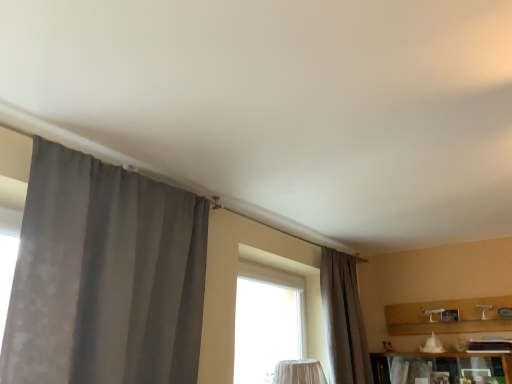
The height and width of the screenshot is (384, 512). What do you see at coordinates (344, 319) in the screenshot?
I see `gray textured curtain at center, acting as the 1th curtain starting from the right` at bounding box center [344, 319].

Measure the distance between gray textured curtain at center, acting as the 1th curtain starting from the right, and camera.

They are 10.87 feet apart.

You are a GUI agent. You are given a task and a screenshot of the screen. Output one action in this format:
    pyautogui.click(x=<x>, y=<y>)
    Task: Click on the gray textured curtain at center, the 2th curtain from the left
    This screenshot has width=512, height=384.
    Given the screenshot: What is the action you would take?
    pyautogui.click(x=344, y=319)

The width and height of the screenshot is (512, 384). What do you see at coordinates (105, 276) in the screenshot? I see `gray fabric curtain at left, which is counted as the first curtain, starting from the front` at bounding box center [105, 276].

What is the approximate width of gray fabric curtain at left, which appears as the 2th curtain when viewed from the right?

The width of gray fabric curtain at left, which appears as the 2th curtain when viewed from the right, is 11.22 inches.

Measure the distance between gray fabric curtain at left, which ranks as the second curtain in back-to-front order, and camera.

gray fabric curtain at left, which ranks as the second curtain in back-to-front order, is 1.61 meters away from camera.

The height and width of the screenshot is (384, 512). What are the coordinates of `gray fabric curtain at left, which is counted as the first curtain, starting from the front` in the screenshot? It's located at (105, 276).

The image size is (512, 384). Identify the location of gray textured curtain at center, the 2th curtain from the left. (344, 319).

Would you say gray textured curtain at center, acting as the 1th curtain starting from the right, is to the left or to the right of gray fabric curtain at left, which is the 1th curtain in left-to-right order, in the picture?

gray textured curtain at center, acting as the 1th curtain starting from the right, is to the right of gray fabric curtain at left, which is the 1th curtain in left-to-right order.

Which object is closer to the camera taking this photo, gray textured curtain at center, the 2th curtain from the left, or gray fabric curtain at left, which is the 1th curtain in left-to-right order?

gray fabric curtain at left, which is the 1th curtain in left-to-right order.

Is point (360, 323) positioned before point (204, 237)?

No, it is not.

From the image's perspective, is gray textured curtain at center, arranged as the 1th curtain when viewed from the back, positioned above or below gray fabric curtain at left, which is the 1th curtain in left-to-right order?

Based on their image positions, gray textured curtain at center, arranged as the 1th curtain when viewed from the back, is located beneath gray fabric curtain at left, which is the 1th curtain in left-to-right order.

From a real-world perspective, is gray textured curtain at center, arranged as the 1th curtain when viewed from the back, physically located above or below gray fabric curtain at left, which is the 1th curtain in left-to-right order?

From a real-world perspective, gray textured curtain at center, arranged as the 1th curtain when viewed from the back, is physically below gray fabric curtain at left, which is the 1th curtain in left-to-right order.

Considering the sizes of objects gray textured curtain at center, the 2th curtain from the left, and gray fabric curtain at left, which appears as the 2th curtain when viewed from the right, in the image provided, who is thinner, gray textured curtain at center, the 2th curtain from the left, or gray fabric curtain at left, which appears as the 2th curtain when viewed from the right,?

With smaller width is gray textured curtain at center, the 2th curtain from the left.

Who is taller, gray textured curtain at center, arranged as the 1th curtain when viewed from the back, or gray fabric curtain at left, which is counted as the first curtain, starting from the front?

gray textured curtain at center, arranged as the 1th curtain when viewed from the back, is taller.

Looking at the image, does gray textured curtain at center, positioned as the 2th curtain in front-to-back order, seem bigger or smaller compared to gray fabric curtain at left, which appears as the 2th curtain when viewed from the right?

Considering their sizes, gray textured curtain at center, positioned as the 2th curtain in front-to-back order, takes up less space than gray fabric curtain at left, which appears as the 2th curtain when viewed from the right.

Can we say gray textured curtain at center, arranged as the 1th curtain when viewed from the back, lies outside gray fabric curtain at left, which ranks as the second curtain in back-to-front order?

That's correct, gray textured curtain at center, arranged as the 1th curtain when viewed from the back, is outside of gray fabric curtain at left, which ranks as the second curtain in back-to-front order.

Is gray textured curtain at center, acting as the 1th curtain starting from the right, touching gray fabric curtain at left, which ranks as the second curtain in back-to-front order?

No, gray textured curtain at center, acting as the 1th curtain starting from the right, is not in contact with gray fabric curtain at left, which ranks as the second curtain in back-to-front order.

Is gray textured curtain at center, arranged as the 1th curtain when viewed from the back, positioned with its back to gray fabric curtain at left, which is the 1th curtain in left-to-right order?

No, gray fabric curtain at left, which is the 1th curtain in left-to-right order, is not at the back of gray textured curtain at center, arranged as the 1th curtain when viewed from the back.

What's the angular difference between gray textured curtain at center, the 2th curtain from the left, and gray fabric curtain at left, which ranks as the second curtain in back-to-front order,'s facing directions?

0.000194 degrees.

Measure the distance from gray textured curtain at center, arranged as the 1th curtain when viewed from the back, to gray fabric curtain at left, which appears as the 2th curtain when viewed from the right.

gray textured curtain at center, arranged as the 1th curtain when viewed from the back, is 6.33 feet from gray fabric curtain at left, which appears as the 2th curtain when viewed from the right.

This screenshot has height=384, width=512. In order to click on curtain above the gray textured curtain at center, arranged as the 1th curtain when viewed from the back (from a real-world perspective) in this screenshot , I will do `click(105, 276)`.

Is gray fabric curtain at left, which is counted as the first curtain, starting from the front, at the right side of gray textured curtain at center, arranged as the 1th curtain when viewed from the back?

No.

Does gray fabric curtain at left, which appears as the 2th curtain when viewed from the right, come in front of gray textured curtain at center, acting as the 1th curtain starting from the right?

Yes, gray fabric curtain at left, which appears as the 2th curtain when viewed from the right, is closer to the viewer.

Does point (81, 191) come in front of point (368, 369)?

Yes.

From the image's perspective, which one is positioned higher, gray fabric curtain at left, which ranks as the second curtain in back-to-front order, or gray textured curtain at center, acting as the 1th curtain starting from the right?

gray fabric curtain at left, which ranks as the second curtain in back-to-front order, from the image's perspective.

From a real-world perspective, is gray fabric curtain at left, which appears as the 2th curtain when viewed from the right, located beneath gray textured curtain at center, acting as the 1th curtain starting from the right?

Actually, gray fabric curtain at left, which appears as the 2th curtain when viewed from the right, is physically above gray textured curtain at center, acting as the 1th curtain starting from the right, in the real world.

Between gray fabric curtain at left, which appears as the 2th curtain when viewed from the right, and gray textured curtain at center, acting as the 1th curtain starting from the right, which one has smaller width?

Thinner between the two is gray textured curtain at center, acting as the 1th curtain starting from the right.

From their relative heights in the image, would you say gray fabric curtain at left, which is the 1th curtain in left-to-right order, is taller or shorter than gray textured curtain at center, acting as the 1th curtain starting from the right?

Clearly, gray fabric curtain at left, which is the 1th curtain in left-to-right order, is shorter compared to gray textured curtain at center, acting as the 1th curtain starting from the right.

Between gray fabric curtain at left, which is counted as the first curtain, starting from the front, and gray textured curtain at center, positioned as the 2th curtain in front-to-back order, which one has larger size?

gray fabric curtain at left, which is counted as the first curtain, starting from the front.

Can we say gray fabric curtain at left, which ranks as the second curtain in back-to-front order, lies outside gray textured curtain at center, arranged as the 1th curtain when viewed from the back?

Yes, gray fabric curtain at left, which ranks as the second curtain in back-to-front order, is not within gray textured curtain at center, arranged as the 1th curtain when viewed from the back.

Is gray fabric curtain at left, which appears as the 2th curtain when viewed from the right, positioned far away from gray textured curtain at center, positioned as the 2th curtain in front-to-back order?

gray fabric curtain at left, which appears as the 2th curtain when viewed from the right, is positioned a significant distance from gray textured curtain at center, positioned as the 2th curtain in front-to-back order.

Is gray fabric curtain at left, which ranks as the second curtain in back-to-front order, oriented towards gray textured curtain at center, the 2th curtain from the left?

No, gray fabric curtain at left, which ranks as the second curtain in back-to-front order, is not aimed at gray textured curtain at center, the 2th curtain from the left.

Measure the distance from gray fabric curtain at left, which ranks as the second curtain in back-to-front order, to gray textured curtain at center, the 2th curtain from the left.

gray fabric curtain at left, which ranks as the second curtain in back-to-front order, and gray textured curtain at center, the 2th curtain from the left, are 6.33 feet apart.

Locate an element on the screen. The image size is (512, 384). curtain on the right of gray fabric curtain at left, which is counted as the first curtain, starting from the front is located at coordinates (344, 319).

In order to click on curtain lying in front of the gray textured curtain at center, the 2th curtain from the left in this screenshot , I will do `click(105, 276)`.

The image size is (512, 384). In order to click on curtain above the gray textured curtain at center, arranged as the 1th curtain when viewed from the back (from the image's perspective) in this screenshot , I will do (105, 276).